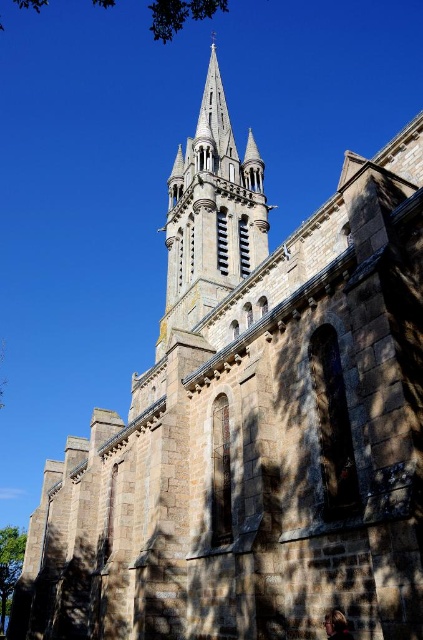
You are standing in front of the grand stone church and notice two points marked on the spire. The first point is at coordinates point (x=247, y=211) and the second is at point (x=181, y=12). Which of these points is closer to you?

Point (x=181, y=12) is closer to you because it is less further to the camera than point (x=247, y=211).

You are standing in front of the church and want to take a photo that includes both the smooth stone tower at center and the green leafy tree at lower left. Which object should you position closer to the bottom of your camera frame to ensure both are fully visible?

You should position the green leafy tree at lower left closer to the bottom of your camera frame because the smooth stone tower at center is taller than the green leafy tree at lower left, so placing the tree lower will ensure both fit within the frame.